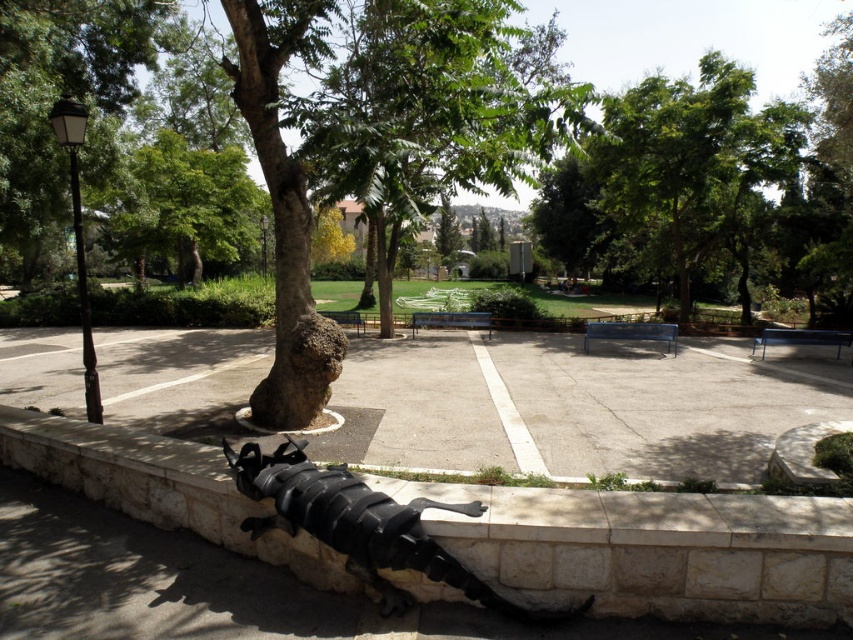
You are planning to install a bird feeder in the park. You want to place it where it will be visible from both the black metallic sculpture and the benches. Which tree should you choose between the green leafy tree at upper right and the green leafy tree at left?

The green leafy tree at upper right is taller than the green leafy tree at left. Since it is taller, placing the bird feeder there would make it more visible from both the black metallic sculpture and the benches.

You are standing at the camera position in the park scene. There is a black stone curb at lower center that you want to reach. Can you walk directly to it without stepping over any obstacles?

The black stone curb at lower center is 3.03 meters away from the camera position. Since there are no mentioned obstacles between them, you can walk directly to it.

Looking at this image, you are a park visitor standing at the edge of the paved area. You want to take a photo of the black matte sculpture at lower center without the green leafy tree at upper right blocking the view. Is this possible from your current position?

The black matte sculpture at lower center is behind the green leafy tree at upper right, so taking a photo of the sculpture without the tree blocking the view from your current position is not possible.